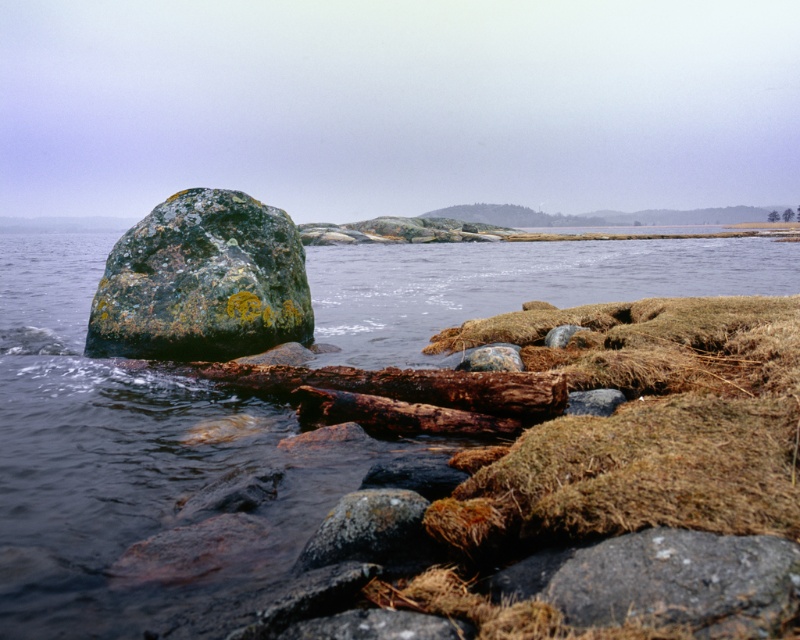
Is green mossy water at center in front of lichen-covered rock at center?

That is False.

Who is more forward, (128, 465) or (398, 509)?

Point (398, 509) is in front.

Image resolution: width=800 pixels, height=640 pixels. I want to click on green mossy water at center, so click(x=84, y=420).

Can you confirm if lichen-covered rock at center is smaller than brown rough log at center?

Yes, lichen-covered rock at center is smaller than brown rough log at center.

You are a GUI agent. You are given a task and a screenshot of the screen. Output one action in this format:
    pyautogui.click(x=<x>, y=<y>)
    Task: Click on the lichen-covered rock at center
    
    Given the screenshot: What is the action you would take?
    pyautogui.click(x=372, y=532)

Is point (328, 532) positioned in front of point (412, 412)?

That is True.

In order to click on lichen-covered rock at center in this screenshot , I will do `click(372, 532)`.

Based on the photo, between lichen-covered rock at left and lichen-covered rock at center, which one is positioned lower?

lichen-covered rock at center is below.

Identify the location of lichen-covered rock at left. This screenshot has width=800, height=640. point(202,282).